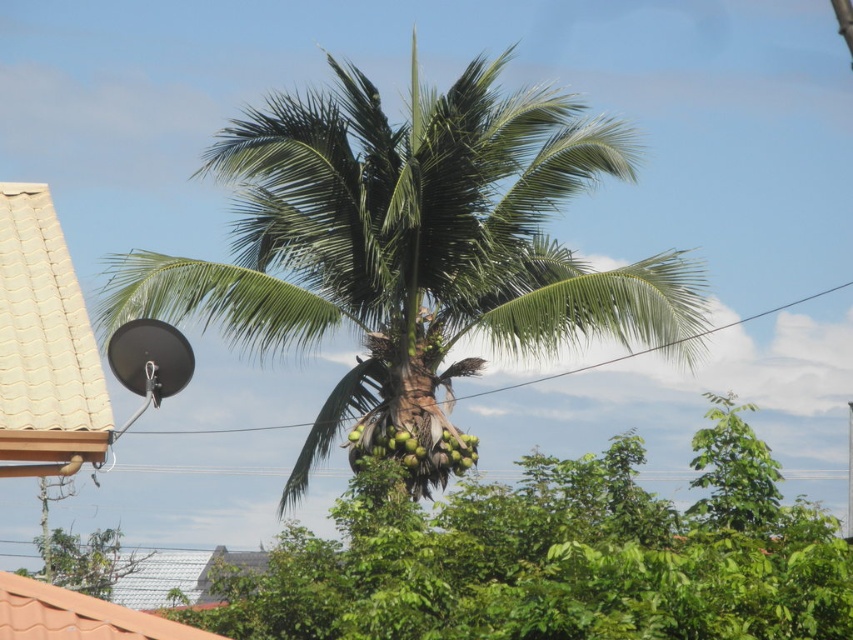
You are planning to plant a new tree in your backyard. You have two options from the image shown. Which tree, the green leafy coconut tree at center or the green leafy palm tree at center, would require more space due to its size?

The green leafy coconut tree at center has a larger size compared to the green leafy palm tree at center, so it would require more space.

You are standing in a tropical area and see a green leafy palm tree at center. If you want to take a photo of it with your smartphone camera, which has a maximum zoom range of 10 meters, will you be able to capture the entire tree without moving closer?

The green leafy palm tree at center is 27.59 meters away from viewer. Since the maximum zoom range is 10 meters, you cannot capture the entire tree without moving closer.

You are planning to hang a birdhouse on the tree. The birdhouse requires a branch that is wider than the green coconut at center. Can you find a suitable branch on the green leafy coconut tree at center?

The green leafy coconut tree at center has a width that surpasses the green coconut at center, so yes, there should be branches wide enough to support the birdhouse.